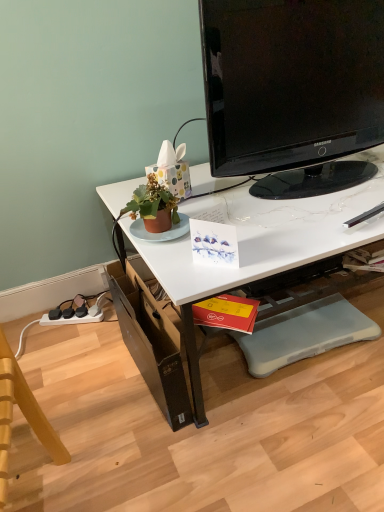
Question: Does gray rubber footrest at lower center have a greater width compared to white glossy desk at upper center?

Choices:
 (A) no
 (B) yes

Answer: (A)

Question: Can you confirm if gray rubber footrest at lower center is bigger than white glossy desk at upper center?

Choices:
 (A) yes
 (B) no

Answer: (B)

Question: Considering the relative sizes of gray rubber footrest at lower center and white glossy desk at upper center in the image provided, is gray rubber footrest at lower center shorter than white glossy desk at upper center?

Choices:
 (A) no
 (B) yes

Answer: (B)

Question: Is gray rubber footrest at lower center placed right next to white glossy desk at upper center?

Choices:
 (A) yes
 (B) no

Answer: (B)

Question: Can you confirm if gray rubber footrest at lower center is smaller than white glossy desk at upper center?

Choices:
 (A) yes
 (B) no

Answer: (A)

Question: Is brown cardboard drawer at lower left spatially inside wooden swivel chair at lower left, or outside of it?

Choices:
 (A) inside
 (B) outside

Answer: (B)

Question: Is brown cardboard drawer at lower left in front of or behind wooden swivel chair at lower left in the image?

Choices:
 (A) front
 (B) behind

Answer: (B)

Question: Considering the positions of brown cardboard drawer at lower left and wooden swivel chair at lower left in the image, is brown cardboard drawer at lower left bigger or smaller than wooden swivel chair at lower left?

Choices:
 (A) small
 (B) big

Answer: (A)

Question: Would you say brown cardboard drawer at lower left is to the left or to the right of wooden swivel chair at lower left in the picture?

Choices:
 (A) left
 (B) right

Answer: (B)

Question: Is white glossy desk at upper center inside or outside of gray rubber footrest at lower center?

Choices:
 (A) outside
 (B) inside

Answer: (A)

Question: In the image, is white glossy desk at upper center positioned in front of or behind gray rubber footrest at lower center?

Choices:
 (A) front
 (B) behind

Answer: (A)

Question: From their relative heights in the image, would you say white glossy desk at upper center is taller or shorter than gray rubber footrest at lower center?

Choices:
 (A) tall
 (B) short

Answer: (A)

Question: Visually, is white glossy desk at upper center positioned to the left or to the right of gray rubber footrest at lower center?

Choices:
 (A) right
 (B) left

Answer: (B)

Question: From the image's perspective, is black glossy television at upper center above or below gray rubber footrest at lower center?

Choices:
 (A) above
 (B) below

Answer: (A)

Question: Do you think black glossy television at upper center is within gray rubber footrest at lower center, or outside of it?

Choices:
 (A) outside
 (B) inside

Answer: (A)